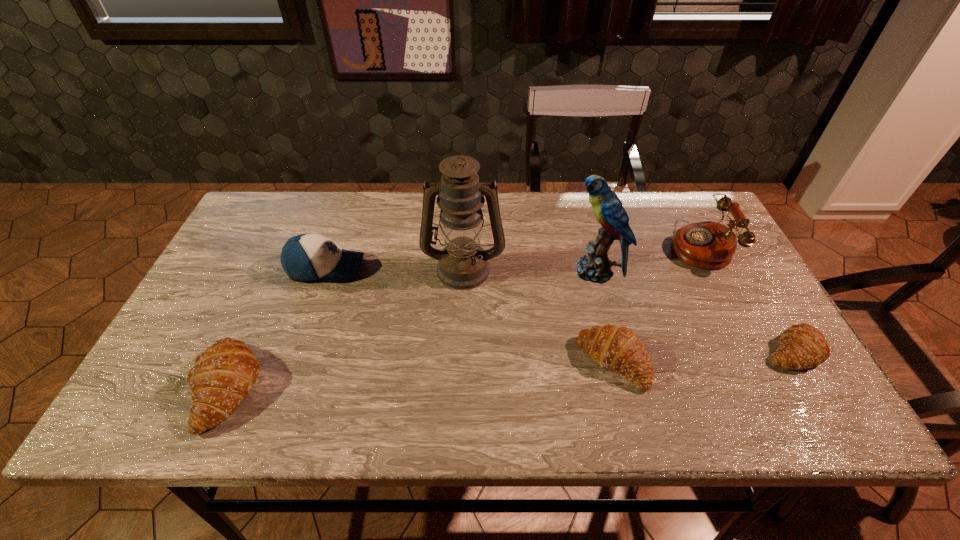
What are the coordinates of `the leftmost crescent roll` in the screenshot? It's located at (222, 376).

You are a GUI agent. You are given a task and a screenshot of the screen. Output one action in this format:
    pyautogui.click(x=<x>, y=<y>)
    Task: Click on the second tallest crescent roll
    
    Given the screenshot: What is the action you would take?
    pyautogui.click(x=615, y=348)

Locate an element on the screen. This screenshot has height=540, width=960. the second crescent roll from left to right is located at coordinates (615, 348).

Locate an element on the screen. the rightmost crescent roll is located at coordinates (802, 346).

Image resolution: width=960 pixels, height=540 pixels. What are the coordinates of `the shortest object` in the screenshot? It's located at (802, 346).

Find the location of a particular element. parrot is located at coordinates (595, 266).

The image size is (960, 540). What are the coordinates of `the fifth shortest object` in the screenshot? It's located at (708, 245).

This screenshot has height=540, width=960. Identify the location of the fourth shortest object. (x=305, y=257).

Locate an element on the screen. oil lamp is located at coordinates (463, 264).

You are a GUI agent. You are given a task and a screenshot of the screen. Output one action in this format:
    pyautogui.click(x=<x>, y=<y>)
    Task: Click on the free region located on the back of the leftmost crescent roll
    This screenshot has width=960, height=540.
    Given the screenshot: What is the action you would take?
    pyautogui.click(x=291, y=244)